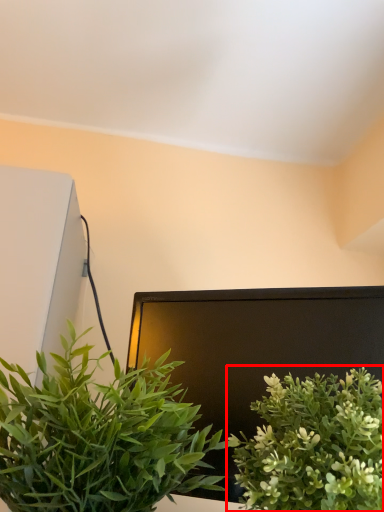
Question: From the image's perspective, what is the correct spatial relationship of houseplant (annotated by the red box) in relation to houseplant?

Choices:
 (A) above
 (B) below

Answer: (B)